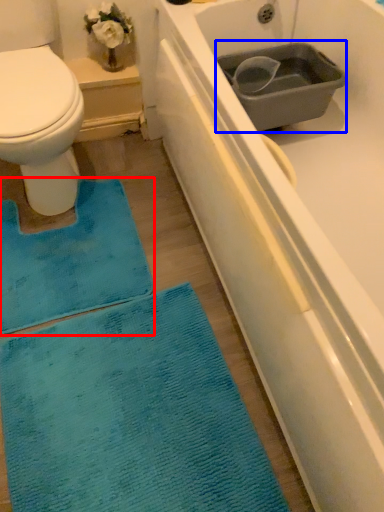
Question: Which of the following is the closest to the observer, doormat (highlighted by a red box) or sink (highlighted by a blue box)?

Choices:
 (A) doormat
 (B) sink

Answer: (A)